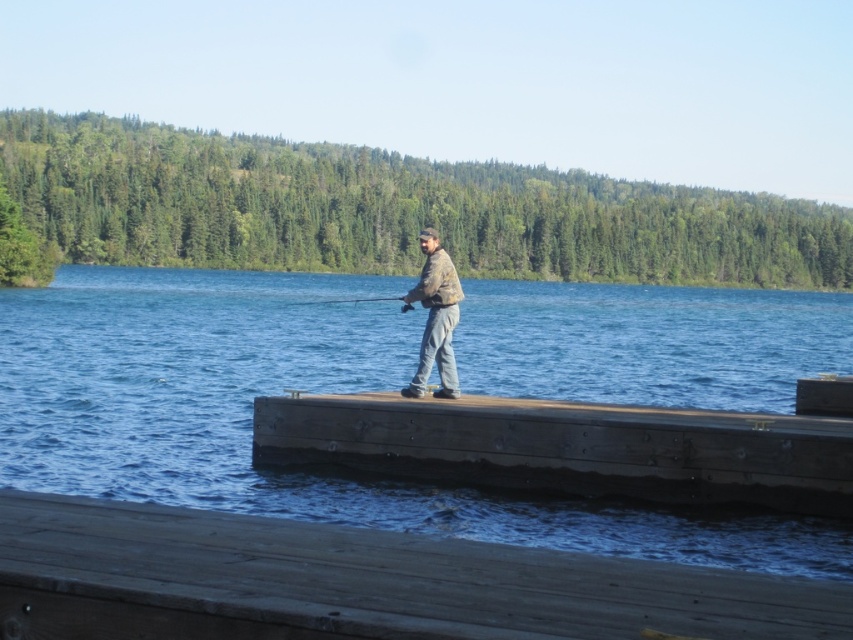
Is brown wooden dock at center below brown wood dock at center?

No.

Which is below, brown wooden dock at center or brown wood dock at center?

brown wood dock at center is lower down.

Between point (97, 588) and point (782, 424), which one is positioned behind?

Point (782, 424)

In order to click on brown wooden dock at center in this screenshot , I will do `click(358, 582)`.

The width and height of the screenshot is (853, 640). Describe the element at coordinates (280, 394) in the screenshot. I see `blue water at center` at that location.

Which of these two, blue water at center or brown wood dock at center, stands taller?

With more height is blue water at center.

The height and width of the screenshot is (640, 853). I want to click on blue water at center, so click(x=280, y=394).

Is brown wooden dock at center positioned at the back of smooth wooden fishing pole at center?

No, it is in front of smooth wooden fishing pole at center.

Does point (602, 593) come closer to viewer compared to point (323, 301)?

Yes.

What are the coordinates of `brown wooden dock at center` in the screenshot? It's located at (358, 582).

The width and height of the screenshot is (853, 640). Identify the location of brown wooden dock at center. (358, 582).